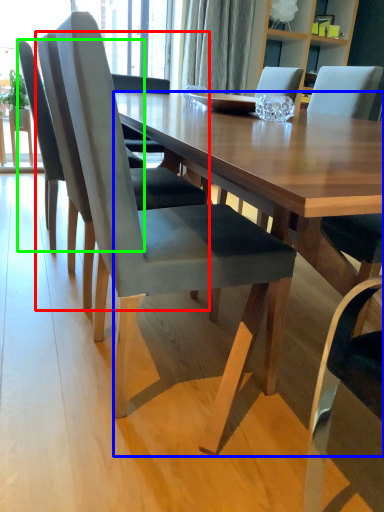
Question: Based on their relative distances, which object is nearer to chair (highlighted by a red box)? Choose from desk (highlighted by a blue box) and chair (highlighted by a green box).

Choices:
 (A) desk
 (B) chair

Answer: (B)